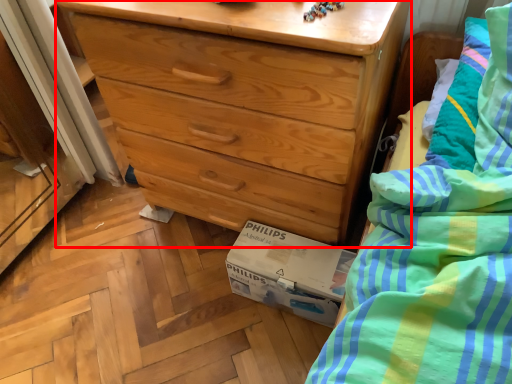
Question: Considering the relative positions of chest of drawers (annotated by the red box) and cardboard box in the image provided, where is chest of drawers (annotated by the red box) located with respect to the staircase?

Choices:
 (A) right
 (B) left

Answer: (B)